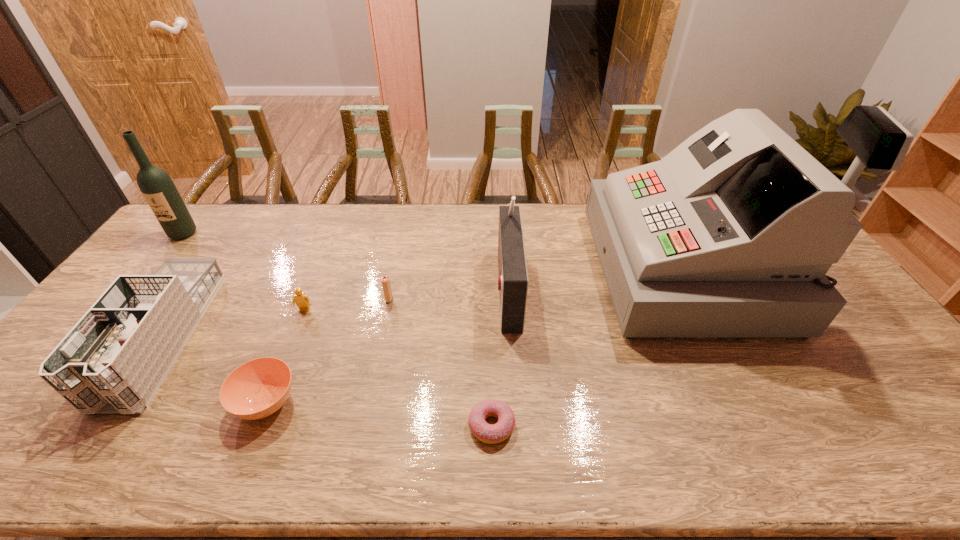
Identify the location of unoccupied position between the soup bowl and the doughnut. The width and height of the screenshot is (960, 540). (379, 414).

Where is `vacant space in between the radio receiver and the shortest object`? The image size is (960, 540). vacant space in between the radio receiver and the shortest object is located at coordinates click(x=499, y=356).

Identify the location of free space between the doughnut and the soup bowl. This screenshot has width=960, height=540. 379,414.

Where is `free space between the doughnut and the fourth object from right to left`? free space between the doughnut and the fourth object from right to left is located at coordinates (441, 362).

Identify the location of empty space between the dollhouse and the tallest object. The height and width of the screenshot is (540, 960). (424, 303).

Locate an element on the screen. This screenshot has width=960, height=540. the fourth closest object to the second object from left to right is located at coordinates (385, 280).

The width and height of the screenshot is (960, 540). In order to click on object that stands as the fifth closest to the second tallest object in this screenshot , I will do `click(513, 281)`.

This screenshot has width=960, height=540. In order to click on vacant region that satisfies the following two spatial constraints: 1. at the entrance of the soup bowl; 2. on the right side of the fourth tallest object in this screenshot , I will do `click(120, 402)`.

Find the location of a particular element. vacant region that satisfies the following two spatial constraints: 1. on the front side of the fifth object from left to right; 2. on the left side of the shortest object is located at coordinates (363, 426).

Locate an element on the screen. This screenshot has height=540, width=960. free spot that satisfies the following two spatial constraints: 1. on the front panel of the radio receiver; 2. on the face of the Lego is located at coordinates (509, 310).